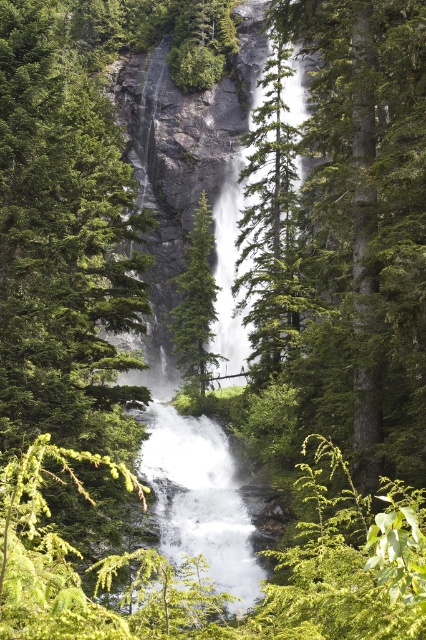
You are a hiker trying to identify two trees in the center of the scene. Which tree has a larger size between the green textured tree at center and the green matte tree at center?

The green textured tree at center is bigger than the green matte tree at center.

You are a hiker standing at the base of the waterfall. You want to take a photo of the white frothy water at center without the green textured tree at center blocking the view. Is it possible to move to a position where the tree is not in front of the water?

The white frothy water at center is behind the green textured tree at center, so moving around might not help as the tree is in front. To capture the water without the tree, you would need to position yourself where the tree is out of the frame or obscured by other elements.